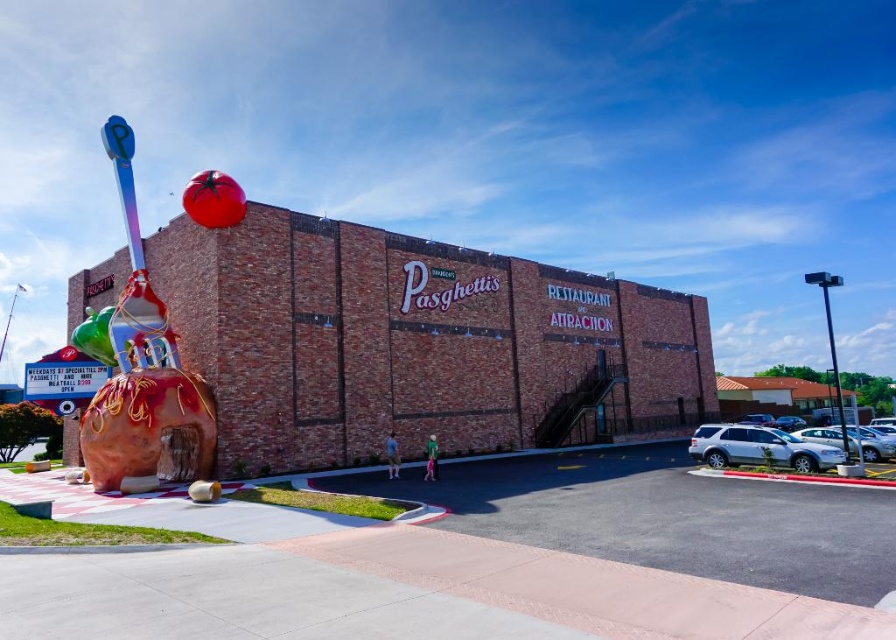
You are a tour guide leading a group to the entrance of Pasquetti Restaurant and Attraction. You are currently standing at the shiny metallic spoon at left and need to reach the black metal pole at right, which is near the entrance. Can you walk directly to the pole without any obstacles? The path is 25.64 meters long. Is the distance manageable for a quick walk?

The distance between the shiny metallic spoon at left and the black metal pole at right is 25.64 meters. A quick walk over this distance is manageable, so yes, you can reach the pole without issues.

You are standing in front of Pasquetti Restaurant and Attraction. You see a brick building at center and a metallic pole at right. Which object is closer to the left side of the scene?

The brick building at center is positioned on the left side of metallic pole at right, so it is closer to the left side of the scene.